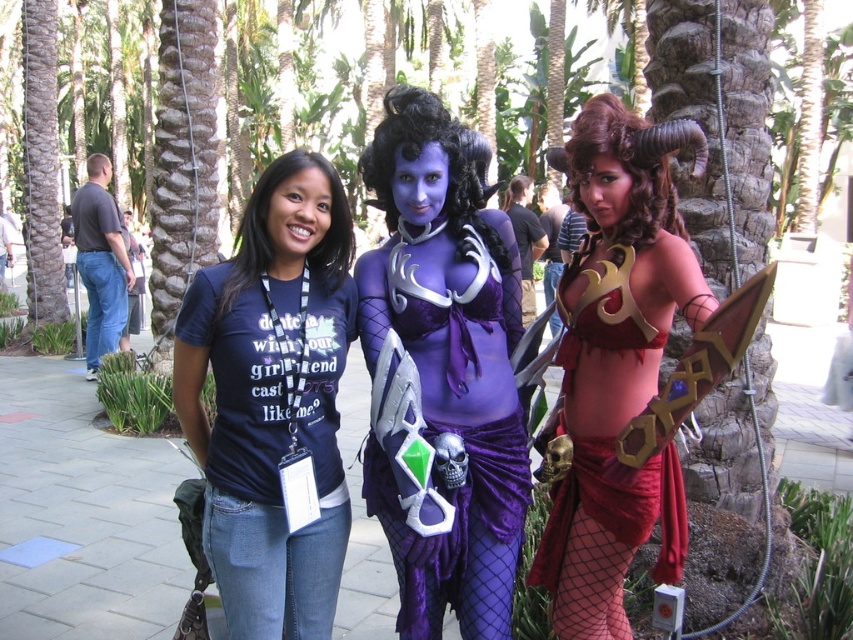
Question: Does matte blue t-shirt at center have a larger size compared to purple velvet dress at center?

Choices:
 (A) no
 (B) yes

Answer: (A)

Question: Is matte blue t-shirt at center wider than purple velvet dress at center?

Choices:
 (A) yes
 (B) no

Answer: (A)

Question: Estimate the real-world distances between objects in this image. Which object is closer to the matte blue t-shirt at center?

Choices:
 (A) matte purple armor at center
 (B) purple velvet dress at center

Answer: (B)

Question: Is matte blue t-shirt at center to the left of purple velvet dress at center from the viewer's perspective?

Choices:
 (A) no
 (B) yes

Answer: (B)

Question: Which object appears closest to the camera in this image?

Choices:
 (A) matte purple armor at center
 (B) purple velvet dress at center

Answer: (A)

Question: Estimate the real-world distances between objects in this image. Which object is farther from the matte blue t-shirt at center?

Choices:
 (A) purple velvet dress at center
 (B) matte purple armor at center

Answer: (B)